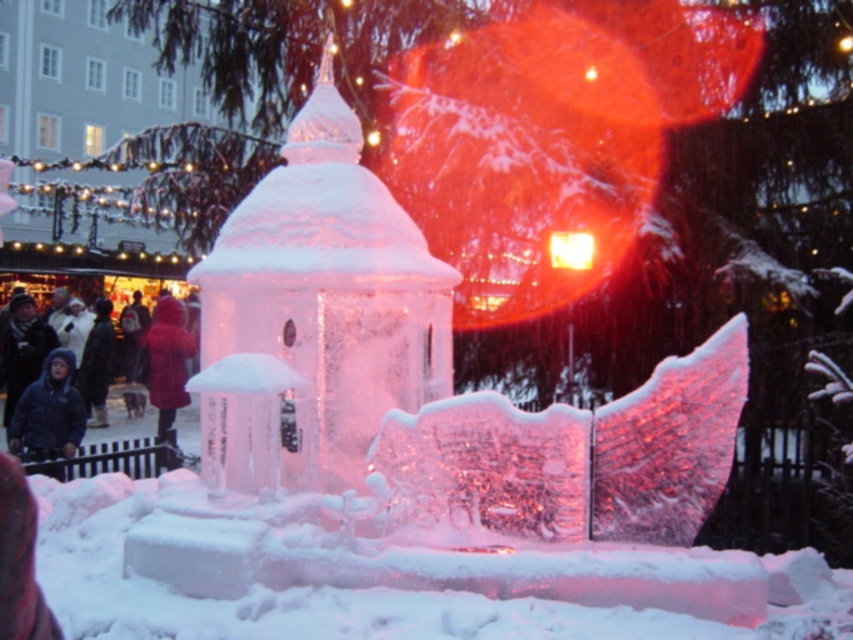
Question: Among these objects, which one is farthest from the camera?

Choices:
 (A) blue woolen jacket at lower left
 (B) icy white snow at center

Answer: (A)

Question: Can you confirm if black fuzzy jacket at lower left is smaller than red wool coat at center?

Choices:
 (A) yes
 (B) no

Answer: (A)

Question: Which of the following is the closest to the observer?

Choices:
 (A) black fuzzy jacket at lower left
 (B) icy white snow at center

Answer: (B)

Question: Which object is closer to the camera taking this photo?

Choices:
 (A) black fuzzy jacket at lower left
 (B) blue woolen jacket at lower left
 (C) icy white snow at center

Answer: (C)

Question: Is icy white snow at center smaller than black fuzzy jacket at lower left?

Choices:
 (A) yes
 (B) no

Answer: (A)

Question: Can you confirm if icy white snow at center is positioned below red wool coat at center?

Choices:
 (A) no
 (B) yes

Answer: (B)